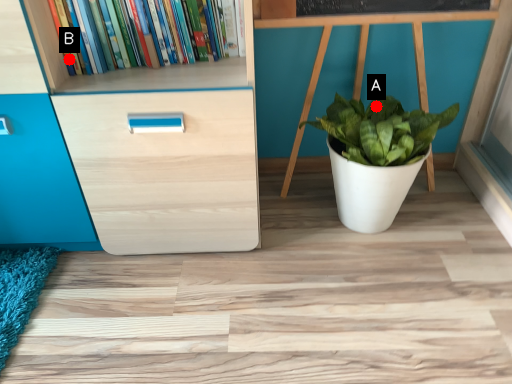
Question: Two points are circled on the image, labeled by A and B beside each circle. Which point is farther to the camera?

Choices:
 (A) A is further
 (B) B is further

Answer: (A)